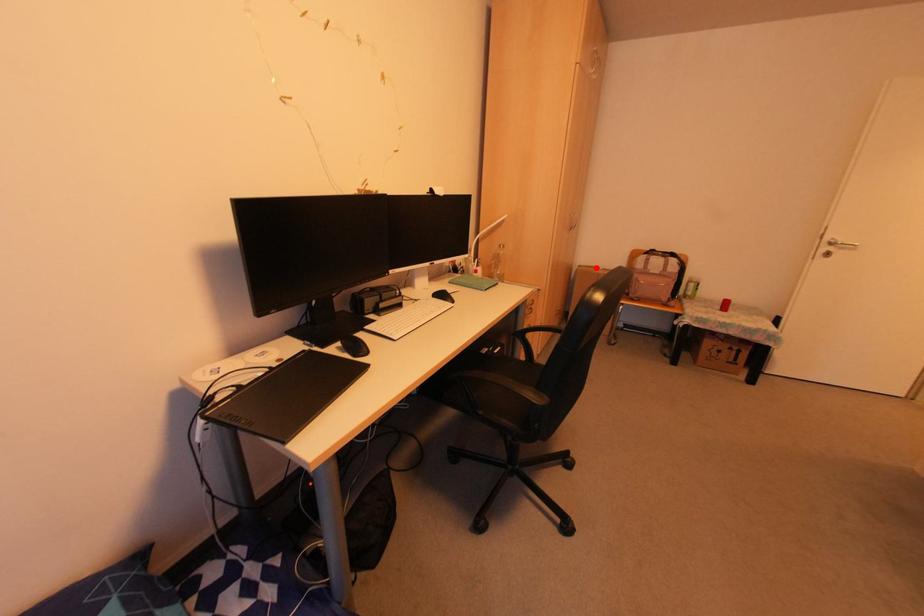
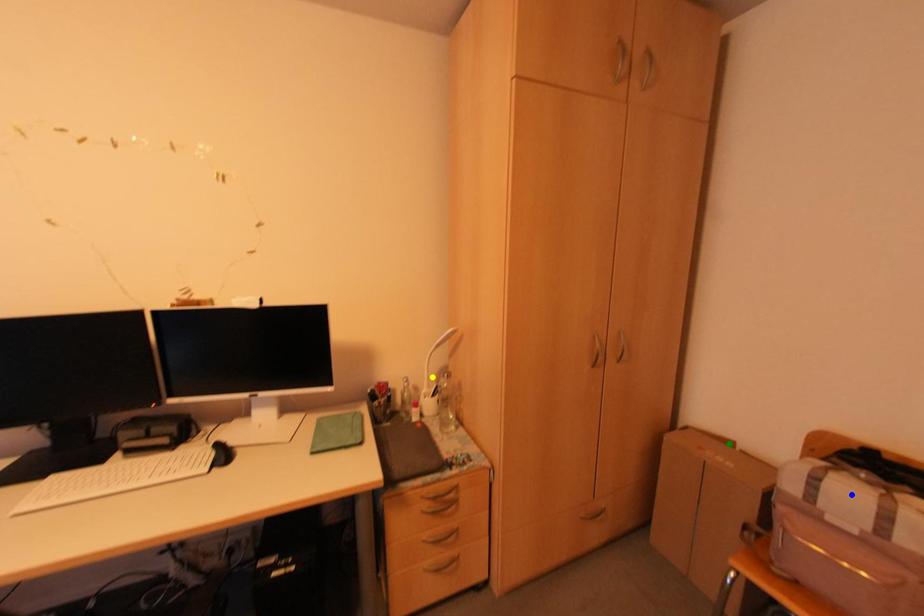
Question: I am providing you with two images of the same scene from different viewpoints. A red point is marked on the first image. You are given multiple points on the second image. Which point in image 2 is actually the same real-world point as the red point in image 1?

Choices:
 (A) yellow point
 (B) blue point
 (C) green point

Answer: (C)